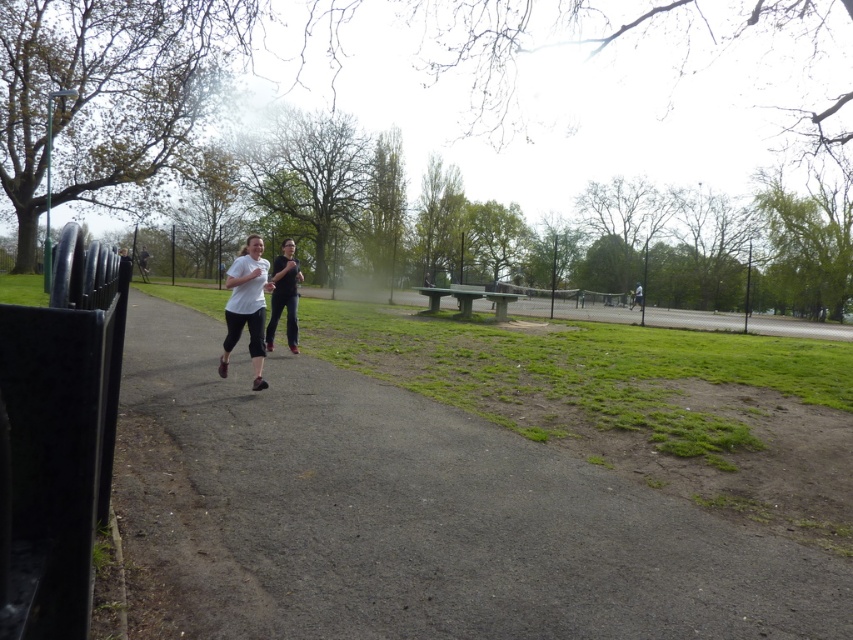
Question: Is white matte t-shirt at center bigger than black matte pants at center?

Choices:
 (A) no
 (B) yes

Answer: (B)

Question: Which object appears farthest from the camera in this image?

Choices:
 (A) black matte pants at center
 (B) gray asphalt path at center

Answer: (A)

Question: Is the position of white matte t-shirt at center less distant than that of black matte pants at center?

Choices:
 (A) yes
 (B) no

Answer: (A)

Question: Which point appears closest to the camera in this image?

Choices:
 (A) (242, 280)
 (B) (137, 472)
 (C) (289, 348)

Answer: (B)

Question: Can you confirm if white matte t-shirt at center is wider than black matte pants at center?

Choices:
 (A) no
 (B) yes

Answer: (B)

Question: Which point is farther from the camera taking this photo?

Choices:
 (A) (457, 596)
 (B) (225, 276)

Answer: (B)